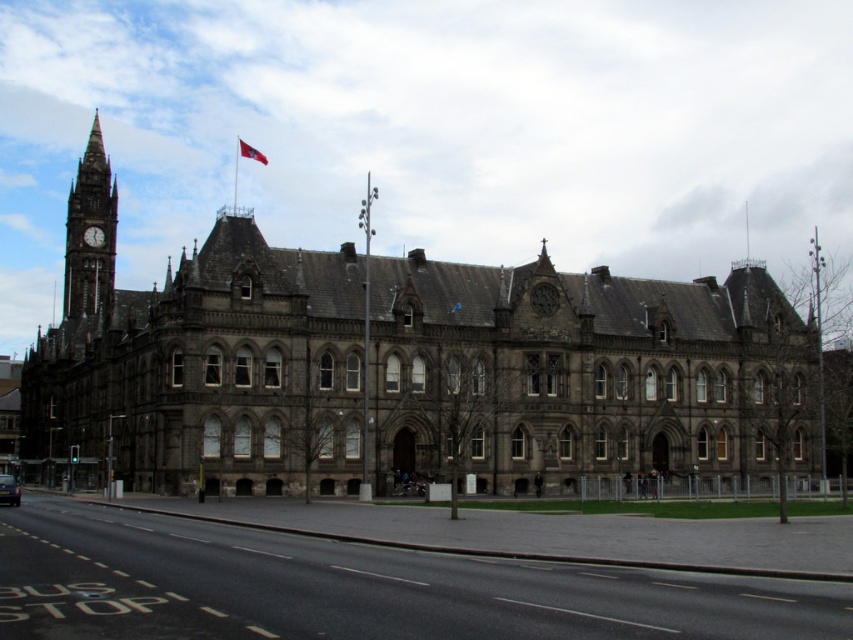
Who is more distant from viewer, (9, 483) or (451, 307)?

Point (451, 307)

Where is `metallic silver car at lower left`? This screenshot has height=640, width=853. metallic silver car at lower left is located at coordinates (9, 490).

Is point (114, 240) closer to camera compared to point (247, 152)?

Yes, point (114, 240) is closer to viewer.

Can you confirm if dark gray stone clock tower at left is taller than red fabric flag at upper center?

Indeed, dark gray stone clock tower at left has a greater height compared to red fabric flag at upper center.

Is point (100, 264) positioned before point (254, 154)?

Yes, point (100, 264) is closer to viewer.

This screenshot has height=640, width=853. I want to click on dark gray stone clock tower at left, so click(84, 228).

Does point (96, 232) lie behind point (256, 154)?

No, it is in front of (256, 154).

Who is more forward, (102, 236) or (248, 154)?

Point (102, 236)

I want to click on matte gray clock at upper left, so click(93, 236).